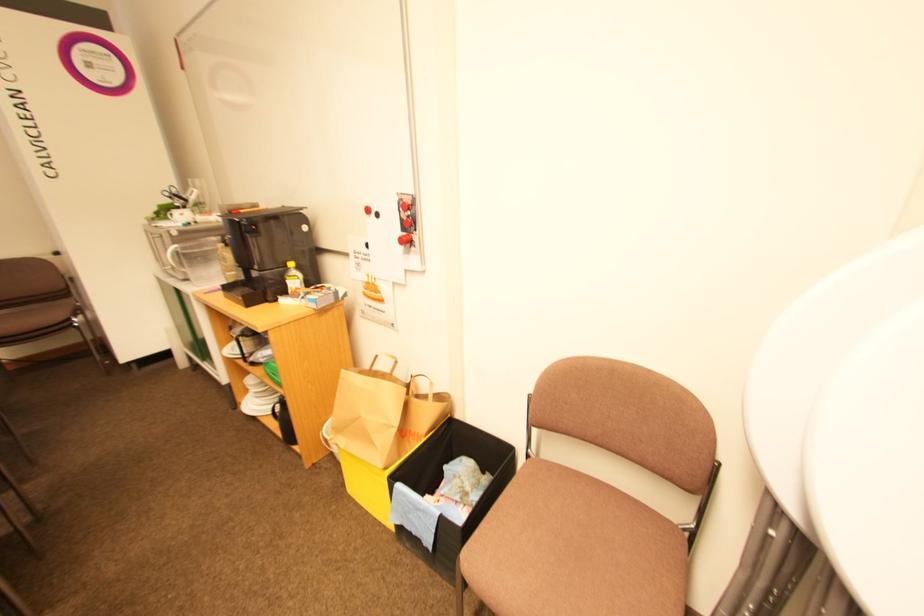
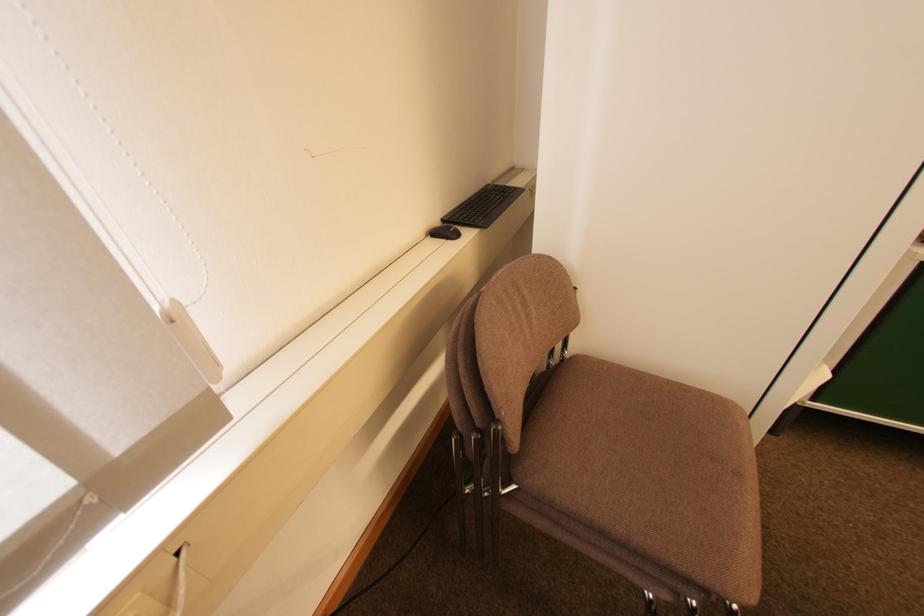
The images are taken continuously from a first-person perspective. In which direction are you moving?

The cameraman moved toward left, forward.